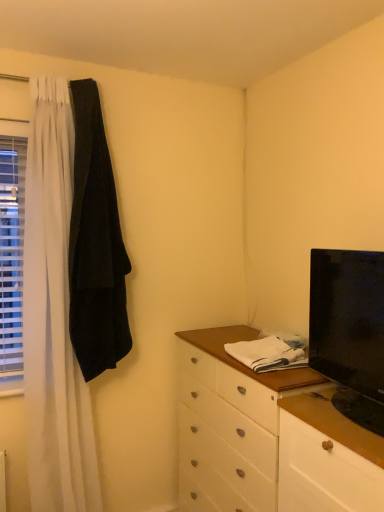
Question: From a real-world perspective, is white plastic blinds at left physically located above or below black glossy tv at right?

Choices:
 (A) below
 (B) above

Answer: (B)

Question: In terms of size, does white plastic blinds at left appear bigger or smaller than black glossy tv at right?

Choices:
 (A) small
 (B) big

Answer: (A)

Question: Which object is positioned closest to the black glossy tv at right?

Choices:
 (A) white plastic blinds at left
 (B) white wood counter top at center
 (C) black velvet robe at left

Answer: (B)

Question: Which is farther from the white plastic blinds at left?

Choices:
 (A) white wood counter top at center
 (B) black glossy tv at right
 (C) black velvet robe at left

Answer: (B)